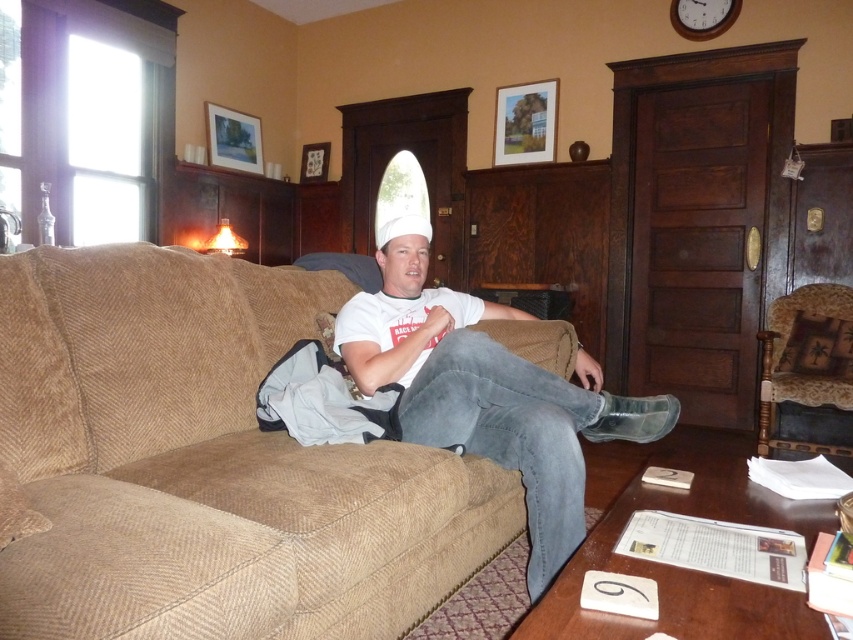
Can you confirm if brown fabric couch at center is positioned below white matte t-shirt at center?

Correct, brown fabric couch at center is located below white matte t-shirt at center.

What do you see at coordinates (207, 464) in the screenshot? I see `brown fabric couch at center` at bounding box center [207, 464].

You are a GUI agent. You are given a task and a screenshot of the screen. Output one action in this format:
    pyautogui.click(x=<x>, y=<y>)
    Task: Click on the brown fabric couch at center
    This screenshot has height=640, width=853.
    Given the screenshot: What is the action you would take?
    click(207, 464)

Which is more to the left, brown fabric couch at center or patterned fabric armchair at right?

Positioned to the left is brown fabric couch at center.

Which is more to the right, brown fabric couch at center or patterned fabric armchair at right?

patterned fabric armchair at right

Image resolution: width=853 pixels, height=640 pixels. In order to click on brown fabric couch at center in this screenshot , I will do `click(207, 464)`.

Can you confirm if white matte t-shirt at center is shorter than patterned fabric armchair at right?

No, white matte t-shirt at center is not shorter than patterned fabric armchair at right.

Which of these two, white matte t-shirt at center or patterned fabric armchair at right, stands shorter?

With less height is patterned fabric armchair at right.

Between point (396, 285) and point (820, 316), which one is positioned behind?

The point (820, 316) is behind.

Locate an element on the screen. white matte t-shirt at center is located at coordinates (486, 392).